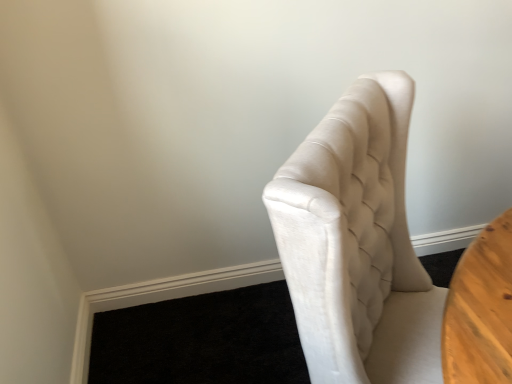
In order to click on satin beige chair at upper right in this screenshot , I will do `click(357, 243)`.

In the scene shown: Measure the distance between satin beige chair at upper right and camera.

They are 22.01 inches apart.

What do you see at coordinates (357, 243) in the screenshot?
I see `satin beige chair at upper right` at bounding box center [357, 243].

The width and height of the screenshot is (512, 384). Find the location of `satin beige chair at upper right`. satin beige chair at upper right is located at coordinates (357, 243).